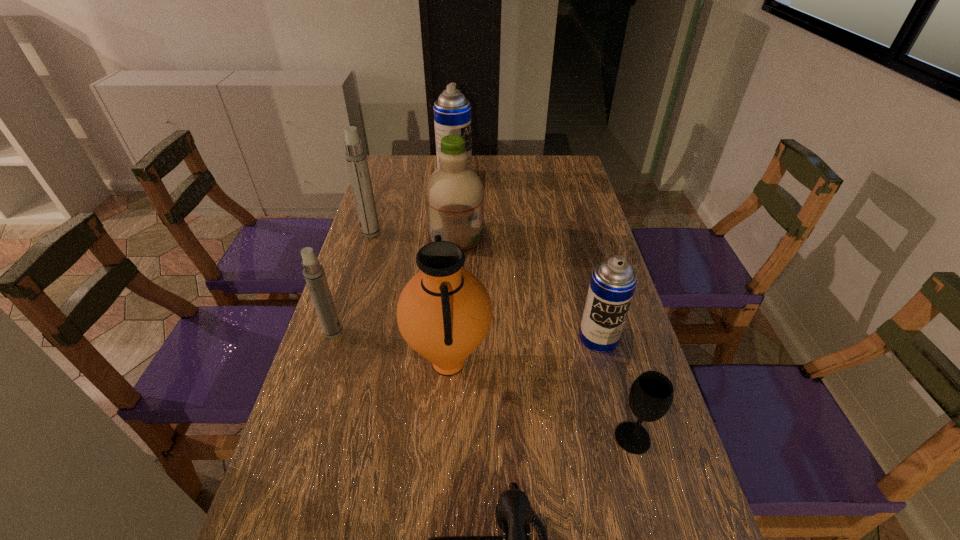
Find the location of `free space at the far edge of the desktop`. free space at the far edge of the desktop is located at coordinates (484, 158).

At what (x,y) coordinates should I click in order to perform the action: click on free space at the left edge of the desktop. Please return your answer as a coordinate pair (x, y). This screenshot has width=960, height=540. Looking at the image, I should click on (399, 199).

Identify the location of free space at the right edge of the desktop. This screenshot has width=960, height=540. (598, 373).

You are a GUI agent. You are given a task and a screenshot of the screen. Output one action in this format:
    pyautogui.click(x=<x>, y=<y>)
    Task: Click on the vacant space at the far left corner
    The width and height of the screenshot is (960, 540).
    Given the screenshot: What is the action you would take?
    pyautogui.click(x=420, y=177)

The image size is (960, 540). What are the coordinates of `vacant space at the far right corner` in the screenshot? It's located at (x=568, y=171).

Where is `empty space between the wineglass and the smaller white aerosol can`? The image size is (960, 540). empty space between the wineglass and the smaller white aerosol can is located at coordinates (483, 385).

You are a GUI agent. You are given a task and a screenshot of the screen. Output one action in this format:
    pyautogui.click(x=<x>, y=<y>)
    Task: Click on the free space between the seventh farthest object and the smaller white aerosol can
    The image size is (960, 540).
    Given the screenshot: What is the action you would take?
    pyautogui.click(x=483, y=385)

This screenshot has width=960, height=540. What are the coordinates of `free point between the cleansing agent and the nearer blue aerosol can` in the screenshot? It's located at (527, 287).

Locate an element on the screen. The image size is (960, 540). free space that is in between the third aerosol can from left to right and the nearer blue aerosol can is located at coordinates (527, 258).

This screenshot has height=540, width=960. I want to click on free space that is in between the cleansing agent and the smaller white aerosol can, so click(x=395, y=284).